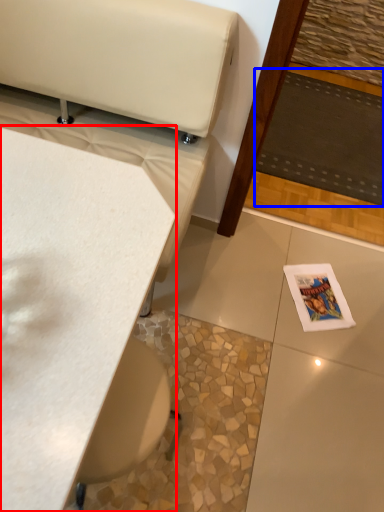
Question: Which of the following is the closest to the observer, table (highlighted by a red box) or mat (highlighted by a blue box)?

Choices:
 (A) table
 (B) mat

Answer: (A)